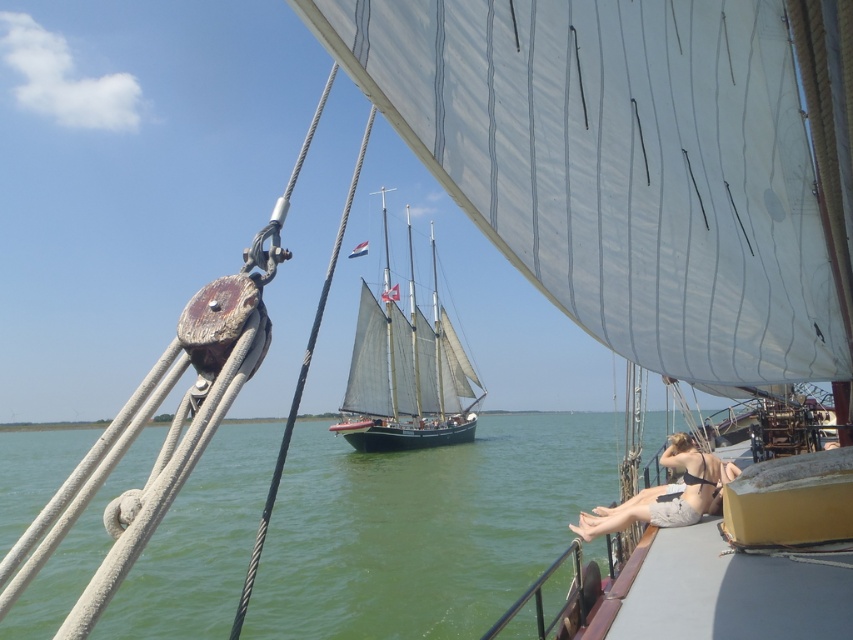
Question: Among these objects, which one is farthest from the camera?

Choices:
 (A) dark blue wooden sailboat at center
 (B) tan bikini top at center
 (C) green water at lower center

Answer: (A)

Question: Which point is farther from the camera taking this photo?

Choices:
 (A) (387, 346)
 (B) (718, 467)
 (C) (140, 458)

Answer: (A)

Question: Where is green water at lower center located in relation to tan bikini top at center in the image?

Choices:
 (A) above
 (B) below

Answer: (B)

Question: Is dark blue wooden sailboat at center to the left of tan bikini top at center from the viewer's perspective?

Choices:
 (A) no
 (B) yes

Answer: (B)

Question: Is dark blue wooden sailboat at center thinner than tan bikini top at center?

Choices:
 (A) no
 (B) yes

Answer: (A)

Question: Which point is closer to the camera?

Choices:
 (A) tan bikini top at center
 (B) green water at lower center

Answer: (B)